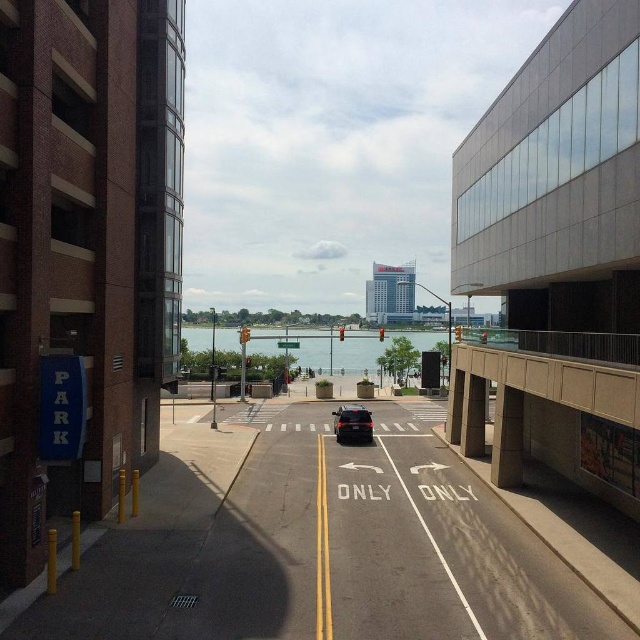
Question: Which of the following is the closest to the observer?

Choices:
 (A) (506, 316)
 (B) (339, 426)

Answer: (B)

Question: Can you confirm if gray concrete parking garage at right is wider than shiny black sedan at center?

Choices:
 (A) no
 (B) yes

Answer: (B)

Question: In this image, where is clear glass water at center located relative to shiny black sedan at center?

Choices:
 (A) left
 (B) right

Answer: (B)

Question: Among these objects, which one is farthest from the camera?

Choices:
 (A) clear glass water at center
 (B) shiny black sedan at center
 (C) brick parking garage at left
 (D) gray concrete parking garage at right

Answer: (A)

Question: Which point is farther to the camera?

Choices:
 (A) (502, 371)
 (B) (369, 436)

Answer: (B)

Question: Is brick parking garage at left further to the viewer compared to concrete overpass at right?

Choices:
 (A) no
 (B) yes

Answer: (B)